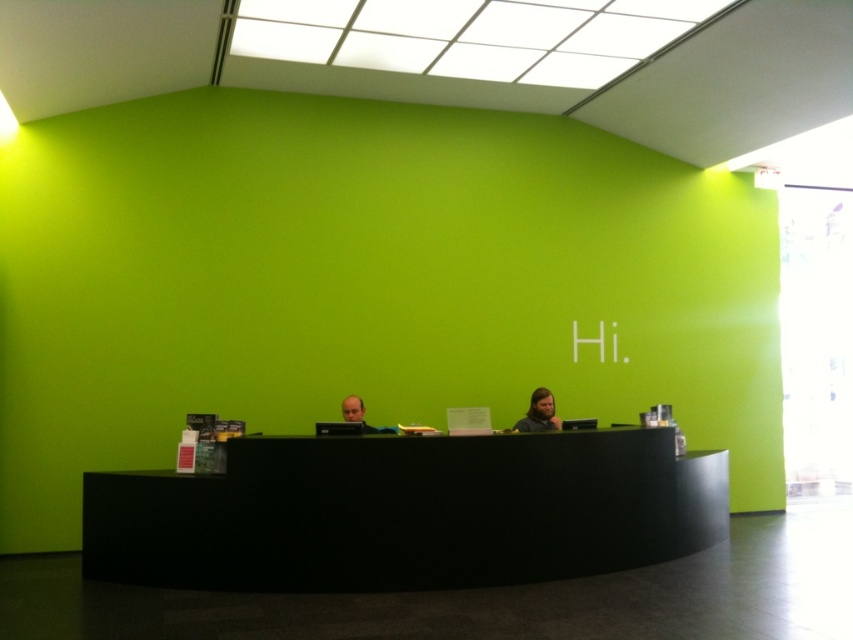
Between dark brown hair at center and matte black laptop at center, which one has more height?

dark brown hair at center

Who is more forward, (544, 408) or (384, 426)?

Point (544, 408) is more forward.

Between point (538, 413) and point (358, 420), which one is positioned behind?

Positioned behind is point (538, 413).

At what (x,y) coordinates should I click in order to perform the action: click on dark brown hair at center. Please return your answer as a coordinate pair (x, y). Looking at the image, I should click on (538, 413).

What do you see at coordinates (407, 513) in the screenshot? The width and height of the screenshot is (853, 640). I see `black matte desk at center` at bounding box center [407, 513].

Is black matte desk at center further to camera compared to dark brown hair at center?

No, it is in front of dark brown hair at center.

Where is `black matte desk at center`? black matte desk at center is located at coordinates (407, 513).

Can you confirm if black matte desk at center is smaller than matte black laptop at center?

Actually, black matte desk at center might be larger than matte black laptop at center.

Can you confirm if black matte desk at center is taller than matte black laptop at center?

Yes, black matte desk at center is taller than matte black laptop at center.

I want to click on black matte desk at center, so click(407, 513).

Locate an element on the screen. The width and height of the screenshot is (853, 640). black matte desk at center is located at coordinates pyautogui.click(x=407, y=513).